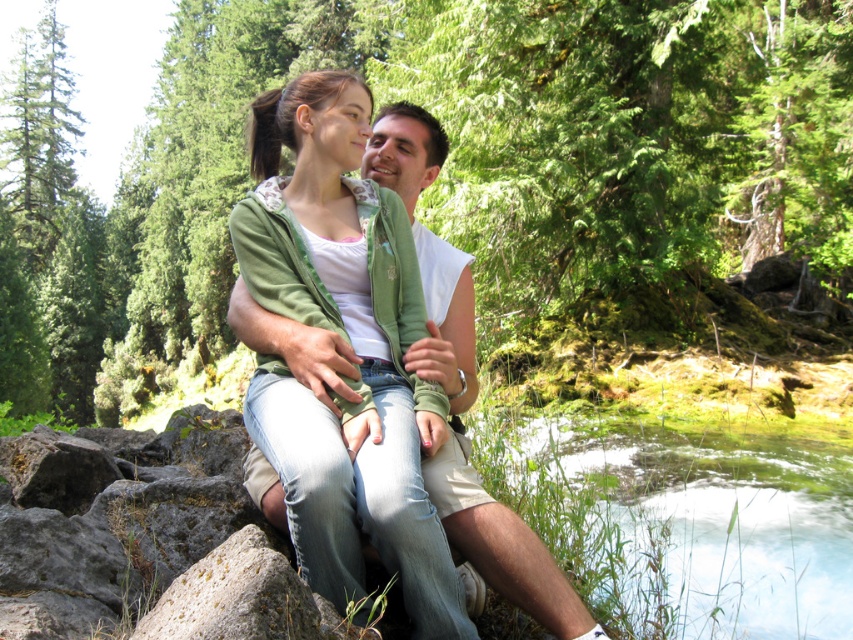
Is green matte jacket at center wider than smooth gray rock at lower left?

Yes.

Is green matte jacket at center to the left of smooth gray rock at lower left from the viewer's perspective?

No, green matte jacket at center is not to the left of smooth gray rock at lower left.

Image resolution: width=853 pixels, height=640 pixels. In order to click on green matte jacket at center in this screenshot , I will do `click(352, 348)`.

At what (x,y) coordinates should I click in order to perform the action: click on green matte jacket at center. Please return your answer as a coordinate pair (x, y). This screenshot has width=853, height=640. Looking at the image, I should click on (352, 348).

Measure the distance between green translucent water at lower right and smooth gray rock at lower left.

green translucent water at lower right is 1.17 meters from smooth gray rock at lower left.

Is green translucent water at lower right shorter than smooth gray rock at lower left?

Incorrect, green translucent water at lower right's height does not fall short of smooth gray rock at lower left's.

Between point (786, 452) and point (207, 608), which one is positioned behind?

Point (786, 452)

Locate an element on the screen. Image resolution: width=853 pixels, height=640 pixels. green translucent water at lower right is located at coordinates (685, 522).

Is green matte jacket at center to the right of green translucent water at lower right from the viewer's perspective?

Incorrect, green matte jacket at center is not on the right side of green translucent water at lower right.

Between green matte jacket at center and green translucent water at lower right, which one has less height?

green translucent water at lower right is shorter.

Where is `green matte jacket at center`? Image resolution: width=853 pixels, height=640 pixels. green matte jacket at center is located at coordinates (352, 348).

Image resolution: width=853 pixels, height=640 pixels. What are the coordinates of `green matte jacket at center` in the screenshot? It's located at (352, 348).